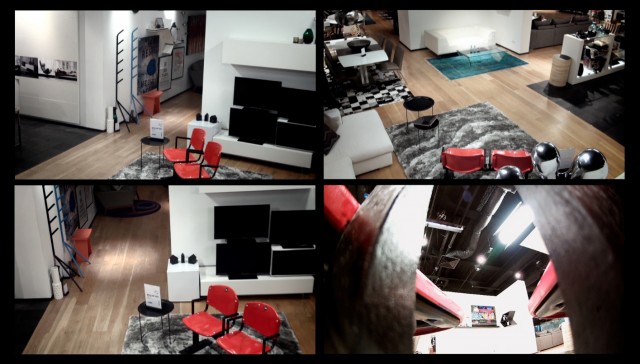
The width and height of the screenshot is (640, 364). What are the coordinates of `glass table` in the screenshot? It's located at (486, 53).